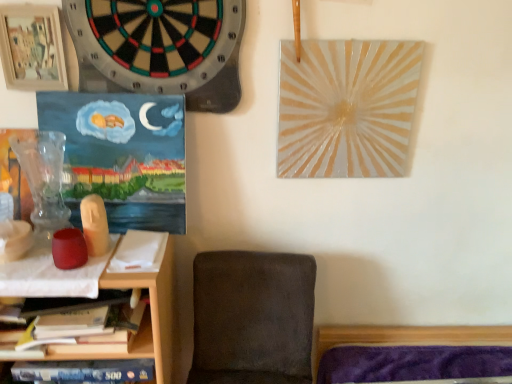
Where is `dark gray fabric chair at lower center`? dark gray fabric chair at lower center is located at coordinates (252, 318).

Where is `wooden shelf at lower left`? The width and height of the screenshot is (512, 384). wooden shelf at lower left is located at coordinates (143, 318).

How many degrees apart are the facing directions of dark gray fabric chair at lower center and black felt dartboard at upper left?

3.25 degrees.

Is point (293, 383) farther from camera compared to point (228, 27)?

Yes.

Is dark gray fabric chair at lower center not within black felt dartboard at upper left?

Yes, dark gray fabric chair at lower center is outside of black felt dartboard at upper left.

Is dark gray fabric chair at lower center positioned before black felt dartboard at upper left?

Yes, it is in front of black felt dartboard at upper left.

Is wooden picture frame at upper left turned away from black felt dartboard at upper left?

That's not correct — wooden picture frame at upper left is not looking away from black felt dartboard at upper left.

Identify the location of picture frame that is above the black felt dartboard at upper left (from the image's perspective). (32, 48).

From the image's perspective, is wooden picture frame at upper left located beneath black felt dartboard at upper left?

No.

Which is behind, wooden picture frame at upper left or black felt dartboard at upper left?

wooden picture frame at upper left is further away from the camera.

Is wooden shelf at lower left wider or thinner than wooden picture frame at upper left?

In the image, wooden shelf at lower left appears to be wider than wooden picture frame at upper left.

Based on the photo, does wooden shelf at lower left have a larger size compared to wooden picture frame at upper left?

Indeed, wooden shelf at lower left has a larger size compared to wooden picture frame at upper left.

In the scene shown: Which object is positioned more to the right, wooden shelf at lower left or wooden picture frame at upper left?

From the viewer's perspective, wooden picture frame at upper left appears more on the right side.

From a real-world perspective, is wooden shelf at lower left on top of wooden picture frame at upper left?

No, from a real-world perspective, wooden shelf at lower left is not above wooden picture frame at upper left.

Between black felt dartboard at upper left and dark gray fabric chair at lower center, which one appears on the right side from the viewer's perspective?

dark gray fabric chair at lower center is more to the right.

Is black felt dartboard at upper left closer to the viewer compared to dark gray fabric chair at lower center?

No, black felt dartboard at upper left is further to the viewer.

Considering the sizes of objects black felt dartboard at upper left and dark gray fabric chair at lower center in the image provided, who is thinner, black felt dartboard at upper left or dark gray fabric chair at lower center?

Thinner between the two is black felt dartboard at upper left.

Which is correct: black felt dartboard at upper left is inside dark gray fabric chair at lower center, or outside of it?

black felt dartboard at upper left lies outside dark gray fabric chair at lower center.

Is the surface of wooden picture frame at upper left in direct contact with wooden shelf at lower left?

wooden picture frame at upper left and wooden shelf at lower left are not in contact.

Is point (38, 51) farther from viewer compared to point (161, 356)?

No, it is not.

Is wooden picture frame at upper left shorter than wooden shelf at lower left?

Indeed, wooden picture frame at upper left has a lesser height compared to wooden shelf at lower left.

This screenshot has height=384, width=512. In order to click on chair below the wooden picture frame at upper left (from the image's perspective) in this screenshot , I will do `click(252, 318)`.

Is wooden picture frame at upper left to the right of dark gray fabric chair at lower center from the viewer's perspective?

In fact, wooden picture frame at upper left is to the left of dark gray fabric chair at lower center.

Is there a large distance between wooden picture frame at upper left and dark gray fabric chair at lower center?

No, wooden picture frame at upper left is not far from dark gray fabric chair at lower center.

Considering the sizes of objects wooden picture frame at upper left and dark gray fabric chair at lower center in the image provided, who is shorter, wooden picture frame at upper left or dark gray fabric chair at lower center?

Standing shorter between the two is wooden picture frame at upper left.

Locate an element on the screen. This screenshot has height=384, width=512. shelf that appears on the left of dark gray fabric chair at lower center is located at coordinates (143, 318).

Is point (232, 332) less distant than point (160, 371)?

No, (232, 332) is behind (160, 371).

Can you confirm if dark gray fabric chair at lower center is taller than wooden shelf at lower left?

Incorrect, the height of dark gray fabric chair at lower center is not larger of that of wooden shelf at lower left.

Can you tell me how much dark gray fabric chair at lower center and wooden shelf at lower left differ in facing direction?

3.21 degrees separate the facing orientations of dark gray fabric chair at lower center and wooden shelf at lower left.

At what (x,y) coordinates should I click in order to perform the action: click on chair below the black felt dartboard at upper left (from the image's perspective). Please return your answer as a coordinate pair (x, y). The width and height of the screenshot is (512, 384). Looking at the image, I should click on (252, 318).

In order to click on picture frame above the black felt dartboard at upper left (from a real-world perspective) in this screenshot , I will do `click(32, 48)`.

Considering their positions, is dark gray fabric chair at lower center positioned further to wooden picture frame at upper left than wooden shelf at lower left?

Based on the image, dark gray fabric chair at lower center appears to be further to wooden picture frame at upper left.

Estimate the real-world distances between objects in this image. Which object is further from black felt dartboard at upper left, wooden picture frame at upper left or dark gray fabric chair at lower center?

The object further to black felt dartboard at upper left is dark gray fabric chair at lower center.

Which object lies nearer to the anchor point black felt dartboard at upper left, dark gray fabric chair at lower center or wooden picture frame at upper left?

The object closer to black felt dartboard at upper left is wooden picture frame at upper left.

Estimate the real-world distances between objects in this image. Which object is closer to dark gray fabric chair at lower center, black felt dartboard at upper left or wooden picture frame at upper left?

black felt dartboard at upper left is positioned closer to the anchor dark gray fabric chair at lower center.

Estimate the real-world distances between objects in this image. Which object is closer to dark gray fabric chair at lower center, wooden shelf at lower left or wooden picture frame at upper left?

The object closer to dark gray fabric chair at lower center is wooden shelf at lower left.

In the scene shown: Estimate the real-world distances between objects in this image. Which object is further from wooden shelf at lower left, wooden picture frame at upper left or dark gray fabric chair at lower center?

Among the two, wooden picture frame at upper left is located further to wooden shelf at lower left.

Which object lies nearer to the anchor point wooden shelf at lower left, black felt dartboard at upper left or dark gray fabric chair at lower center?

dark gray fabric chair at lower center.

Estimate the real-world distances between objects in this image. Which object is closer to black felt dartboard at upper left, wooden picture frame at upper left or wooden shelf at lower left?

Based on the image, wooden picture frame at upper left appears to be nearer to black felt dartboard at upper left.

Find the location of `clock between wooden picture frame at upper left and wooden shelf at lower left vertically`. clock between wooden picture frame at upper left and wooden shelf at lower left vertically is located at coordinates (161, 48).

The image size is (512, 384). I want to click on clock between wooden picture frame at upper left and dark gray fabric chair at lower center from top to bottom, so click(161, 48).

Find the location of a particular element. shelf between wooden picture frame at upper left and dark gray fabric chair at lower center from top to bottom is located at coordinates (143, 318).

Find the location of `shelf between black felt dartboard at upper left and dark gray fabric chair at lower center vertically`. shelf between black felt dartboard at upper left and dark gray fabric chair at lower center vertically is located at coordinates click(x=143, y=318).